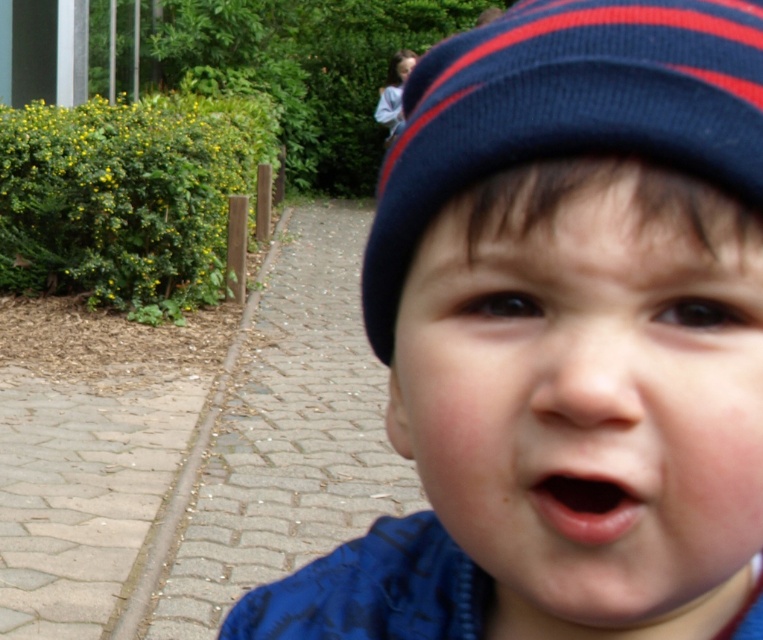
Can you confirm if blue knit cap at upper center is smaller than pink smooth lips at center?

Actually, blue knit cap at upper center might be larger than pink smooth lips at center.

Is the position of blue knit cap at upper center less distant than that of pink smooth lips at center?

Yes, blue knit cap at upper center is closer to the viewer.

The height and width of the screenshot is (640, 763). I want to click on blue knit cap at upper center, so click(x=567, y=112).

Does point (578, 349) come in front of point (594, 484)?

Yes, point (578, 349) is closer to viewer.

Measure the distance from blue knit hat at upper right to pink smooth lips at center.

blue knit hat at upper right is 2.18 inches away from pink smooth lips at center.

You are a GUI agent. You are given a task and a screenshot of the screen. Output one action in this format:
    pyautogui.click(x=<x>, y=<y>)
    Task: Click on the blue knit hat at upper right
    This screenshot has height=640, width=763.
    Given the screenshot: What is the action you would take?
    pyautogui.click(x=588, y=394)

You are a GUI agent. You are given a task and a screenshot of the screen. Output one action in this format:
    pyautogui.click(x=<x>, y=<y>)
    Task: Click on the blue knit hat at upper right
    This screenshot has width=763, height=640.
    Given the screenshot: What is the action you would take?
    pyautogui.click(x=588, y=394)

Between point (546, 72) and point (707, 262), which one is positioned behind?

Positioned behind is point (546, 72).

Which of these two, blue knit hat at center or blue knit hat at upper right, stands shorter?

blue knit hat at upper right is shorter.

Locate an element on the screen. This screenshot has height=640, width=763. blue knit hat at center is located at coordinates (562, 332).

In order to click on blue knit hat at center in this screenshot , I will do `click(562, 332)`.